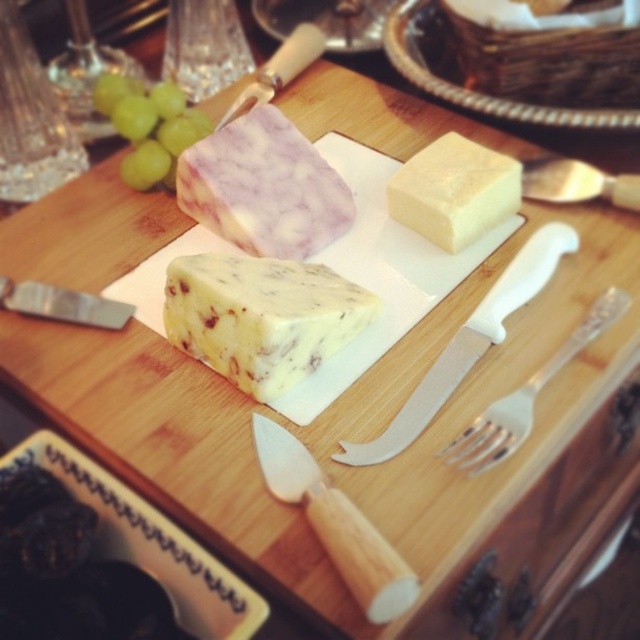
In the scene shown: Where is the white plastic knife at center located on the cheese board?

The white plastic knife at center is located at coordinates point (x=467, y=342) on the cheese board.